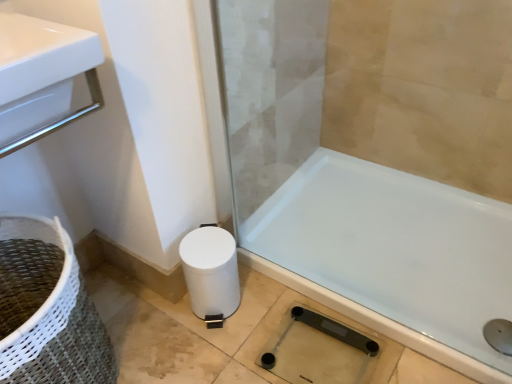
Where is `vacant space in front of transparent glass screen door at lower center`? Image resolution: width=512 pixels, height=384 pixels. vacant space in front of transparent glass screen door at lower center is located at coordinates (301, 255).